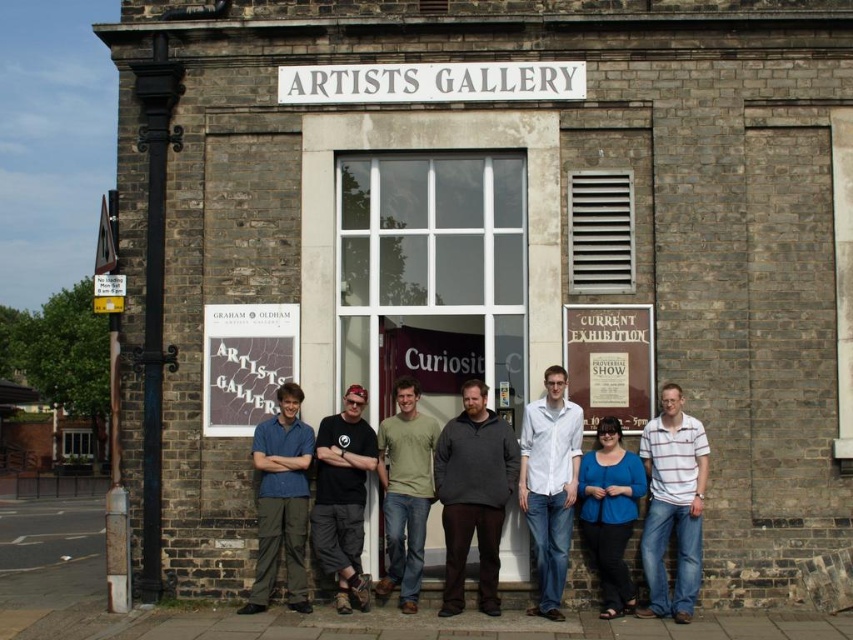
Question: In this image, where is matte blue shirt at center located relative to green matte t-shirt at center?

Choices:
 (A) below
 (B) above

Answer: (A)

Question: Which object is farther from the camera taking this photo?

Choices:
 (A) matte blue shirt at center
 (B) dark gray sweater at center
 (C) black cotton t-shirt at center
 (D) wooden signboard at center

Answer: (D)

Question: Which is nearer to the green matte t-shirt at center?

Choices:
 (A) matte blue shirt at center
 (B) blue matte shirt at center
 (C) wooden signboard at center

Answer: (A)

Question: Is matte blue shirt at center to the left of wooden signboard at center from the viewer's perspective?

Choices:
 (A) no
 (B) yes

Answer: (B)

Question: Does matte blue shirt at center appear on the right side of black cotton t-shirt at center?

Choices:
 (A) no
 (B) yes

Answer: (A)

Question: Which object is positioned closest to the green matte t-shirt at center?

Choices:
 (A) white striped shirt at center
 (B) matte blue shirt at center
 (C) black cotton t-shirt at center

Answer: (C)